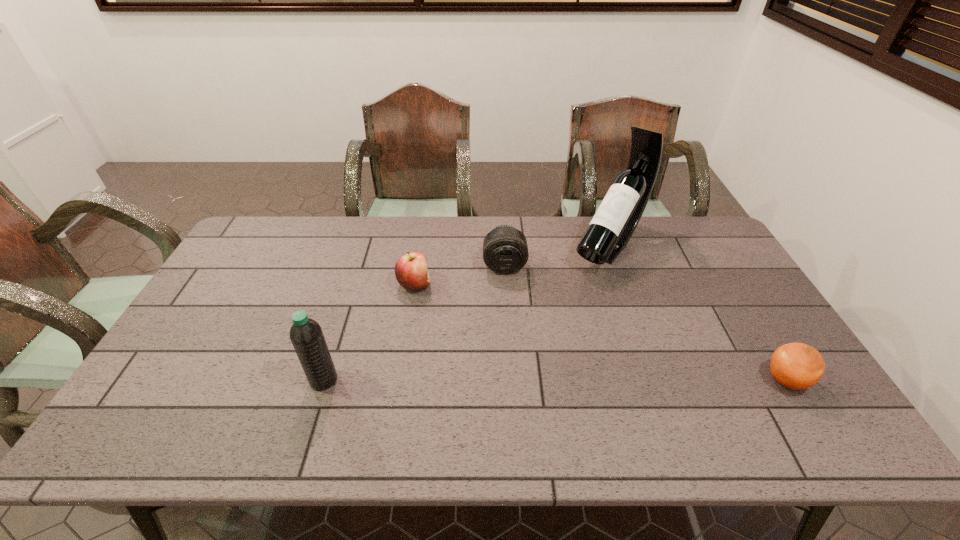
You are a GUI agent. You are given a task and a screenshot of the screen. Output one action in this format:
    pyautogui.click(x=<x>, y=<y>)
    Task: Click on the free space located 0.150m on the front-facing side of the third tallest object
    The image size is (960, 540).
    Given the screenshot: What is the action you would take?
    pyautogui.click(x=507, y=312)

Image resolution: width=960 pixels, height=540 pixels. What are the coordinates of `vacant space situated on the front-facing side of the third tallest object` in the screenshot? It's located at (509, 336).

I want to click on vacant region located 0.360m on the front-facing side of the third tallest object, so click(x=511, y=372).

At what (x,y) coordinates should I click in order to perform the action: click on vacant area situated 0.290m on the bitten side of the apple. Please return your answer as a coordinate pair (x, y). The image size is (960, 540). Looking at the image, I should click on (511, 330).

The height and width of the screenshot is (540, 960). I want to click on vacant space located on the bitten side of the apple, so click(x=540, y=343).

Where is `vacant space located on the bitten side of the apple`? vacant space located on the bitten side of the apple is located at coordinates (444, 299).

This screenshot has width=960, height=540. I want to click on free space located 0.340m on the stand of the tallest object, so click(538, 339).

The height and width of the screenshot is (540, 960). In order to click on blank area located on the stand of the tallest object in this screenshot , I will do `click(556, 318)`.

The image size is (960, 540). What are the coordinates of `free location located on the stand of the tallest object` in the screenshot? It's located at (558, 315).

Locate an element on the screen. telephoto lens that is at the far edge is located at coordinates (505, 251).